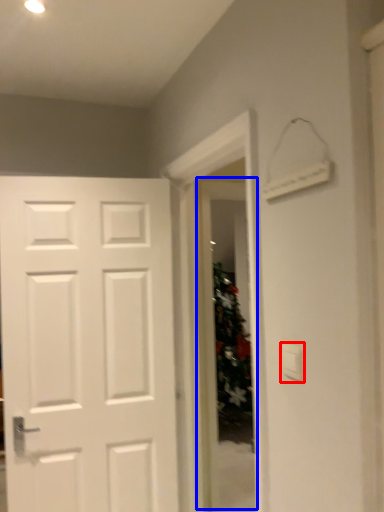
Question: Which point is further to the camera, light switch (highlighted by a red box) or glass door (highlighted by a blue box)?

Choices:
 (A) light switch
 (B) glass door

Answer: (B)